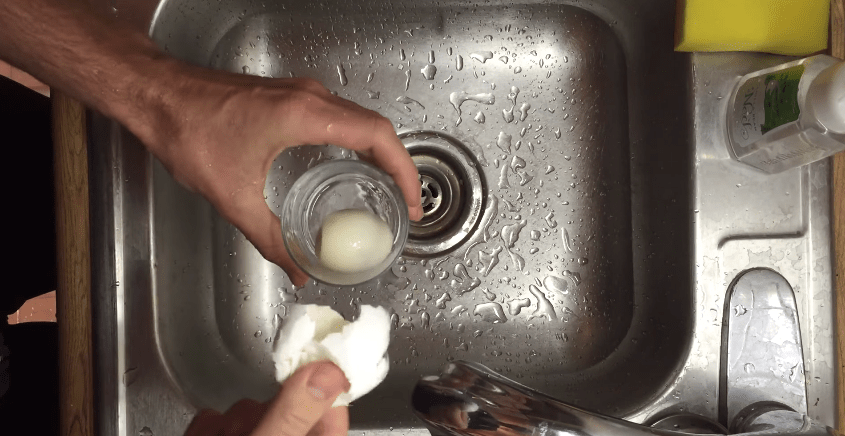
Locate an element on the screen. napkin is located at coordinates (355, 359).